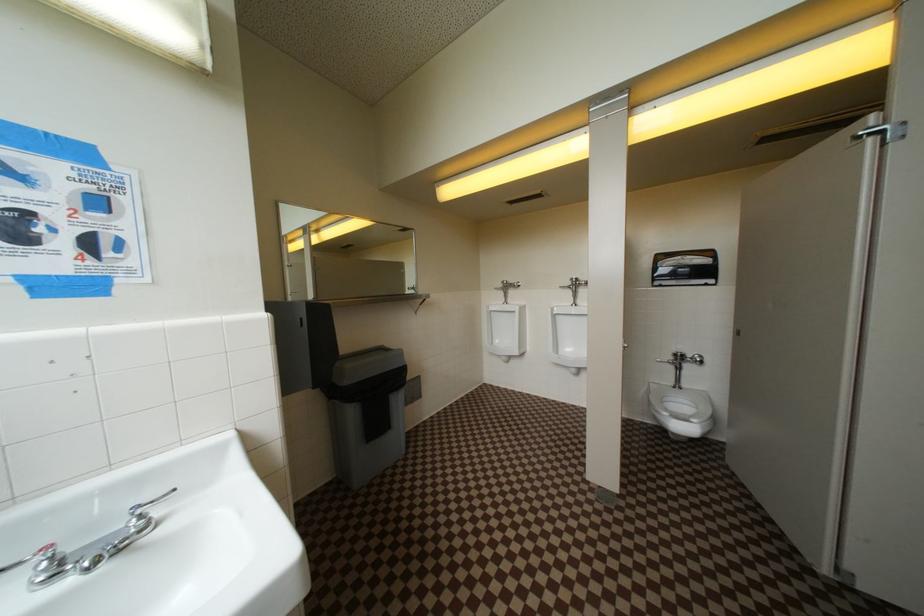
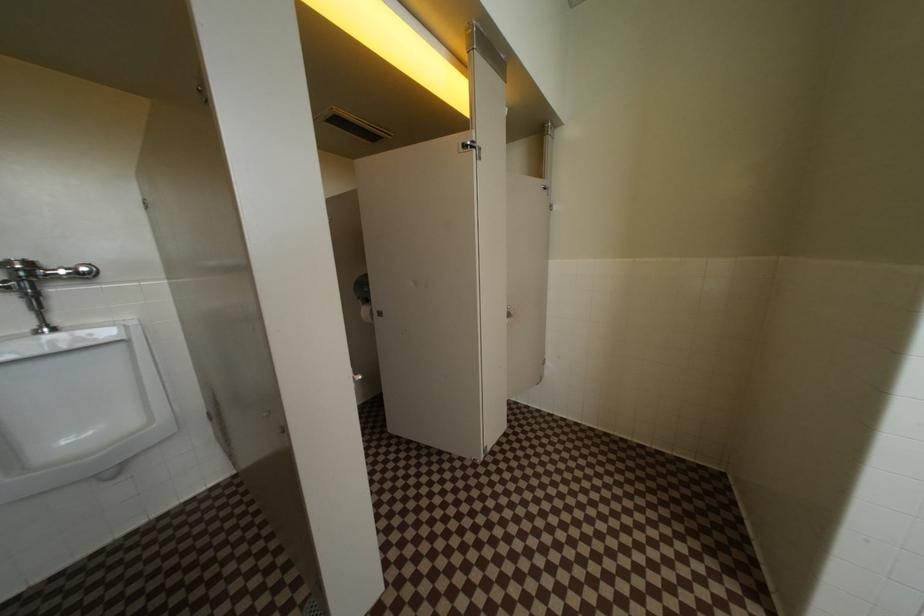
Question: The first image is from the beginning of the video and the second image is from the end. How did the camera likely rotate when shooting the video?

Choices:
 (A) Left
 (B) Right
 (C) Up
 (D) Down

Answer: (B)